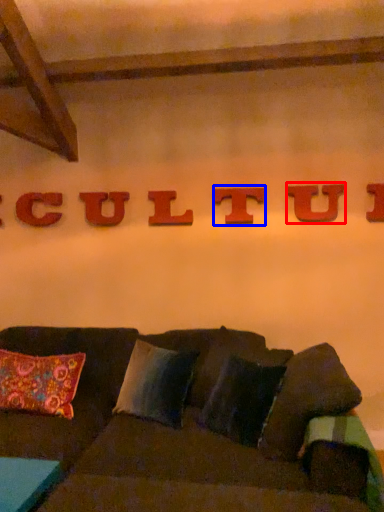
Question: Which of the following is the closest to the observer, letter (highlighted by a red box) or letter (highlighted by a blue box)?

Choices:
 (A) letter
 (B) letter

Answer: (A)